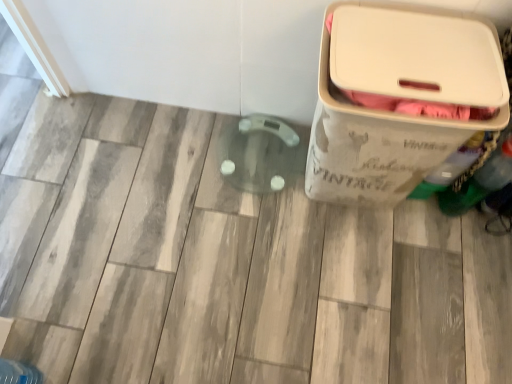
This screenshot has width=512, height=384. I want to click on translucent plastic bottle at upper right, so click(451, 167).

This screenshot has width=512, height=384. Describe the element at coordinates (451, 167) in the screenshot. I see `translucent plastic bottle at upper right` at that location.

Looking at this image, in order to face translucent plastic bottle at upper right, should I rotate leftwards or rightwards?

Turn right approximately 24.941 degrees to face it.

The width and height of the screenshot is (512, 384). What do you see at coordinates (398, 99) in the screenshot?
I see `beige plastic container at right` at bounding box center [398, 99].

Find the location of `beige plastic container at right`. beige plastic container at right is located at coordinates (398, 99).

Locate an element on the screen. The image size is (512, 384). translucent plastic bottle at upper right is located at coordinates (451, 167).

Which is more to the left, translucent plastic bottle at upper right or beige plastic container at right?

beige plastic container at right.

Is the depth of translucent plastic bottle at upper right greater than that of beige plastic container at right?

Yes, the depth of translucent plastic bottle at upper right is greater than that of beige plastic container at right.

Is point (418, 187) positioned before point (379, 81)?

No.

From the image's perspective, would you say translucent plastic bottle at upper right is positioned over beige plastic container at right?

Actually, translucent plastic bottle at upper right appears below beige plastic container at right in the image.

From a real-world perspective, which object stands above the other?

beige plastic container at right, from a real-world perspective.

Does translucent plastic bottle at upper right have a lesser width compared to beige plastic container at right?

Yes.

Considering the sizes of objects translucent plastic bottle at upper right and beige plastic container at right in the image provided, who is taller, translucent plastic bottle at upper right or beige plastic container at right?

beige plastic container at right.

Is translucent plastic bottle at upper right bigger or smaller than beige plastic container at right?

In the image, translucent plastic bottle at upper right appears to be smaller than beige plastic container at right.

Is translucent plastic bottle at upper right surrounding beige plastic container at right?

No, beige plastic container at right is not a part of translucent plastic bottle at upper right.

Is translucent plastic bottle at upper right far from beige plastic container at right?

No, translucent plastic bottle at upper right is not far from beige plastic container at right.

Is translucent plastic bottle at upper right facing towards beige plastic container at right?

No.

How different are the orientations of translucent plastic bottle at upper right and beige plastic container at right in degrees?

The facing directions of translucent plastic bottle at upper right and beige plastic container at right are 0.129 degrees apart.

Find the location of a particular element. This screenshot has width=512, height=384. bottle on the right of beige plastic container at right is located at coordinates (451, 167).

Considering the positions of objects beige plastic container at right and translucent plastic bottle at upper right in the image provided, who is more to the left, beige plastic container at right or translucent plastic bottle at upper right?

beige plastic container at right is more to the left.

Is beige plastic container at right further to the viewer compared to translucent plastic bottle at upper right?

No, beige plastic container at right is closer to the viewer.

Which is in front, point (362, 62) or point (485, 149)?

Point (362, 62)

From the image's perspective, which is above, beige plastic container at right or translucent plastic bottle at upper right?

beige plastic container at right.

From a real-world perspective, is beige plastic container at right positioned over translucent plastic bottle at upper right based on gravity?

Yes, from a real-world perspective, beige plastic container at right is on top of translucent plastic bottle at upper right.

Is beige plastic container at right wider than translucent plastic bottle at upper right?

Correct, the width of beige plastic container at right exceeds that of translucent plastic bottle at upper right.

Considering the sizes of objects beige plastic container at right and translucent plastic bottle at upper right in the image provided, who is taller, beige plastic container at right or translucent plastic bottle at upper right?

Standing taller between the two is beige plastic container at right.

Is beige plastic container at right bigger or smaller than translucent plastic bottle at upper right?

Considering their sizes, beige plastic container at right takes up more space than translucent plastic bottle at upper right.

Would you say beige plastic container at right is outside translucent plastic bottle at upper right?

Yes, beige plastic container at right is outside of translucent plastic bottle at upper right.

Is there a large distance between beige plastic container at right and translucent plastic bottle at upper right?

No, beige plastic container at right is in close proximity to translucent plastic bottle at upper right.

Is beige plastic container at right looking in the opposite direction of translucent plastic bottle at upper right?

No.

How many degrees apart are the facing directions of beige plastic container at right and translucent plastic bottle at upper right?

There is a 0.129-degree angle between the facing directions of beige plastic container at right and translucent plastic bottle at upper right.

This screenshot has width=512, height=384. Find the location of `bottle below the beige plastic container at right (from a real-world perspective)`. bottle below the beige plastic container at right (from a real-world perspective) is located at coordinates [x=451, y=167].

Locate an element on the screen. The width and height of the screenshot is (512, 384). waste container on the left side of translucent plastic bottle at upper right is located at coordinates (398, 99).

Identify the location of waste container that is in front of the translucent plastic bottle at upper right. This screenshot has width=512, height=384. (398, 99).